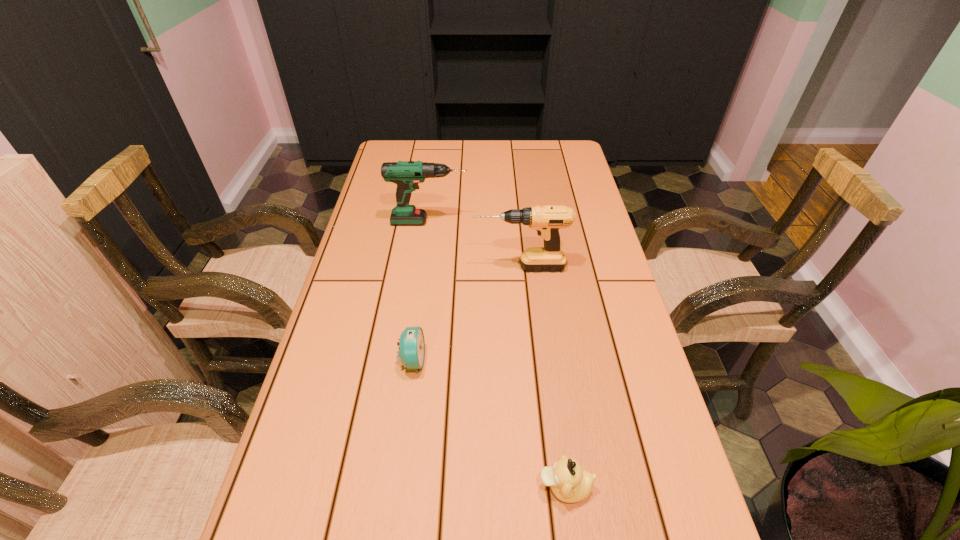
This screenshot has width=960, height=540. Identify the location of unoccupied area between the duckling and the farthest object. (497, 354).

Where is `vacant area between the second nearest object and the second farthest object`? vacant area between the second nearest object and the second farthest object is located at coordinates (467, 314).

Locate an element on the screen. free area in between the duckling and the third nearest object is located at coordinates (542, 377).

At what (x,y) coordinates should I click in order to perform the action: click on vacant point located between the third farthest object and the farthest object. Please return your answer as a coordinate pair (x, y). This screenshot has width=960, height=540. Looking at the image, I should click on (420, 291).

Image resolution: width=960 pixels, height=540 pixels. What are the coordinates of `free space between the alarm clock and the duckling` in the screenshot? It's located at (489, 424).

Where is `empty location between the alarm clock and the second farthest object`? empty location between the alarm clock and the second farthest object is located at coordinates (467, 314).

Locate an element on the screen. blank region between the alarm clock and the right drill is located at coordinates (467, 314).

The image size is (960, 540). I want to click on free space between the duckling and the right drill, so click(x=542, y=377).

Locate an element on the screen. Image resolution: width=960 pixels, height=540 pixels. vacant point located between the alarm clock and the nearest object is located at coordinates (489, 424).

You are a GUI agent. You are given a task and a screenshot of the screen. Output one action in this format:
    pyautogui.click(x=<x>, y=<y>)
    Task: Click on the free space between the alarm clock and the nearest object
    
    Given the screenshot: What is the action you would take?
    pyautogui.click(x=489, y=424)